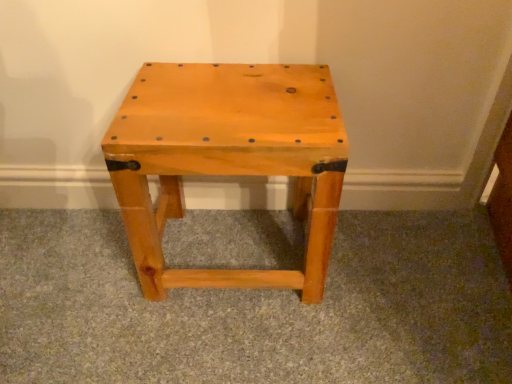
Locate an element on the screen. The width and height of the screenshot is (512, 384). free space in front of natural wood stool at center is located at coordinates (233, 339).